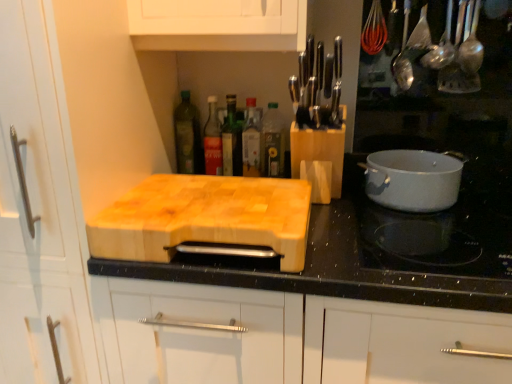
Question: In terms of height, does natural wood cutting board at center look taller or shorter compared to wooden cutting board at center?

Choices:
 (A) short
 (B) tall

Answer: (B)

Question: Considering the positions of natural wood cutting board at center and wooden cutting board at center in the image, is natural wood cutting board at center bigger or smaller than wooden cutting board at center?

Choices:
 (A) big
 (B) small

Answer: (A)

Question: Considering the real-world distances, which object is farthest from the white glossy pot at right?

Choices:
 (A) clear glass bottle at center, the fourth bottle when ordered from left to right
 (B) natural wood cutting board at center
 (C) white glossy pot at right
 (D) green glass bottle at center, arranged as the 3th bottle when viewed from the right
 (E) green glass bottle at upper center, which is the first bottle from left to right

Answer: (B)

Question: Which of these objects is positioned closest to the white glossy pot at right?

Choices:
 (A) wooden cutting board at center
 (B) clear glass bottle at center, acting as the 2th bottle starting from the right
 (C) natural wood cutting board at center
 (D) natural wood cutting board at center
 (E) white glossy pot at right

Answer: (E)